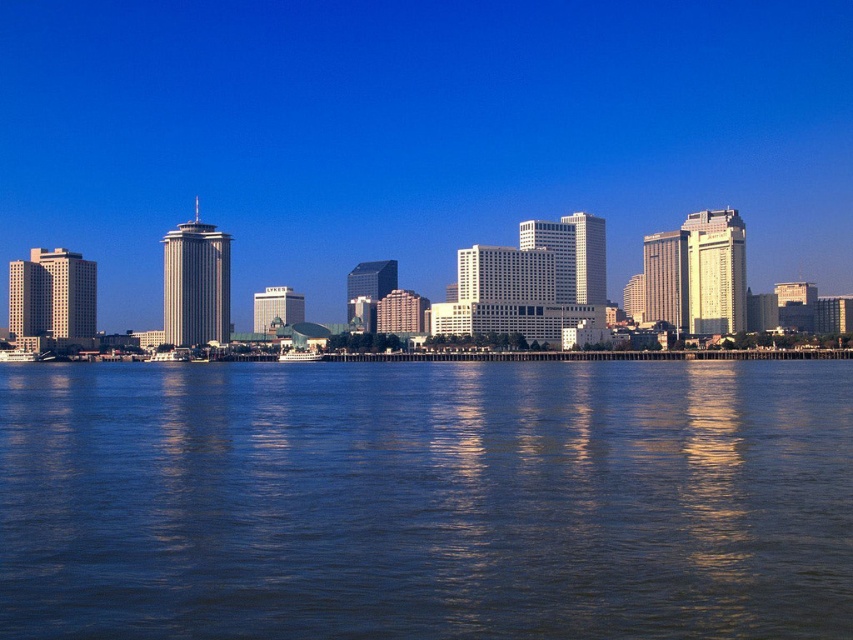
Is blue liquid water at lower center smaller than transparent glass skyscrapers at center?

Yes.

Between point (656, 518) and point (578, 48), which one is positioned in front?

Point (656, 518)

I want to click on blue liquid water at lower center, so click(426, 499).